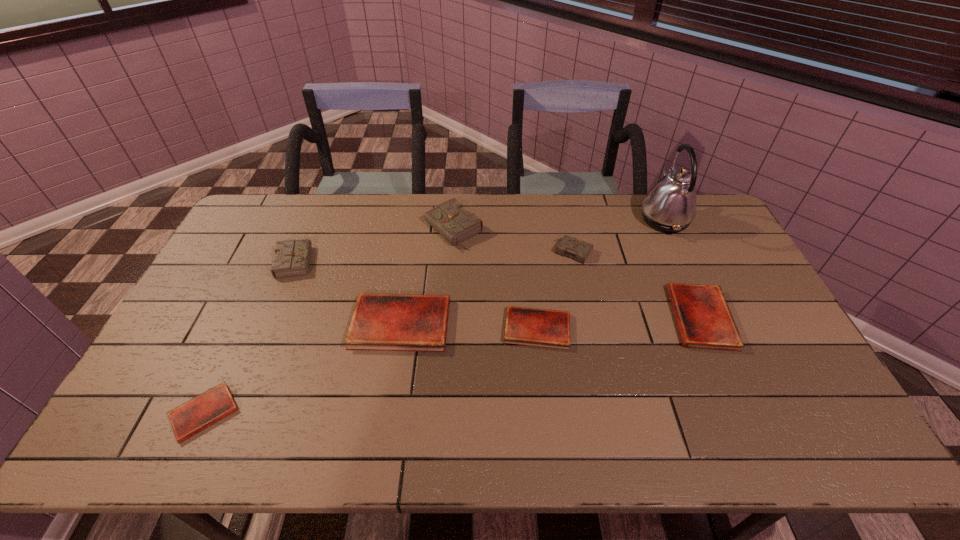
The image size is (960, 540). In order to click on the rightmost diary in this screenshot , I will do `click(704, 320)`.

The height and width of the screenshot is (540, 960). I want to click on the second smallest red diary, so click(536, 327).

This screenshot has width=960, height=540. I want to click on the second shortest diary, so click(536, 327).

Identify the location of the nearest diary. (204, 410).

What are the coordinates of `the nearest object` in the screenshot? It's located at (204, 410).

At what (x,y) coordinates should I click in order to perform the action: click on vacant space located 0.050m from the spout of the tallest object. Please return your answer as a coordinate pair (x, y). The image size is (960, 540). Looking at the image, I should click on (625, 219).

Where is `free space located from the spout of the tallest object`? Image resolution: width=960 pixels, height=540 pixels. free space located from the spout of the tallest object is located at coordinates (597, 219).

Find the location of a particular element. Image resolution: width=960 pixels, height=540 pixels. vacant space located from the spout of the tallest object is located at coordinates (575, 219).

Where is `vacant space located on the left of the second green diary from left to right`? The height and width of the screenshot is (540, 960). vacant space located on the left of the second green diary from left to right is located at coordinates [x=347, y=230].

I want to click on vacant space situated on the right of the third tallest object, so click(x=352, y=259).